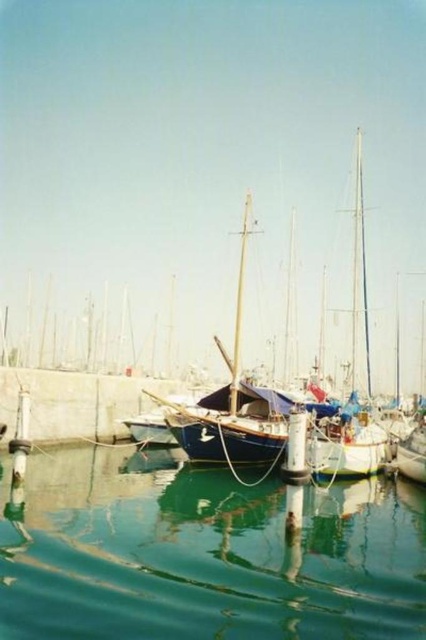
Question: Does green reflective water at center have a lesser width compared to blue canvas sailboat at center?

Choices:
 (A) no
 (B) yes

Answer: (B)

Question: Is green reflective water at center further to the viewer compared to blue canvas sailboat at center?

Choices:
 (A) yes
 (B) no

Answer: (B)

Question: Which point is farther to the camera?

Choices:
 (A) blue canvas sailboat at center
 (B) green reflective water at center

Answer: (A)

Question: Which point is closer to the camera taking this photo?

Choices:
 (A) (311, 561)
 (B) (356, 452)

Answer: (A)

Question: Among these points, which one is farthest from the camera?

Choices:
 (A) (29, 528)
 (B) (333, 474)

Answer: (B)

Question: From the image, what is the correct spatial relationship of green reflective water at center in relation to blue canvas sailboat at center?

Choices:
 (A) below
 (B) above

Answer: (A)